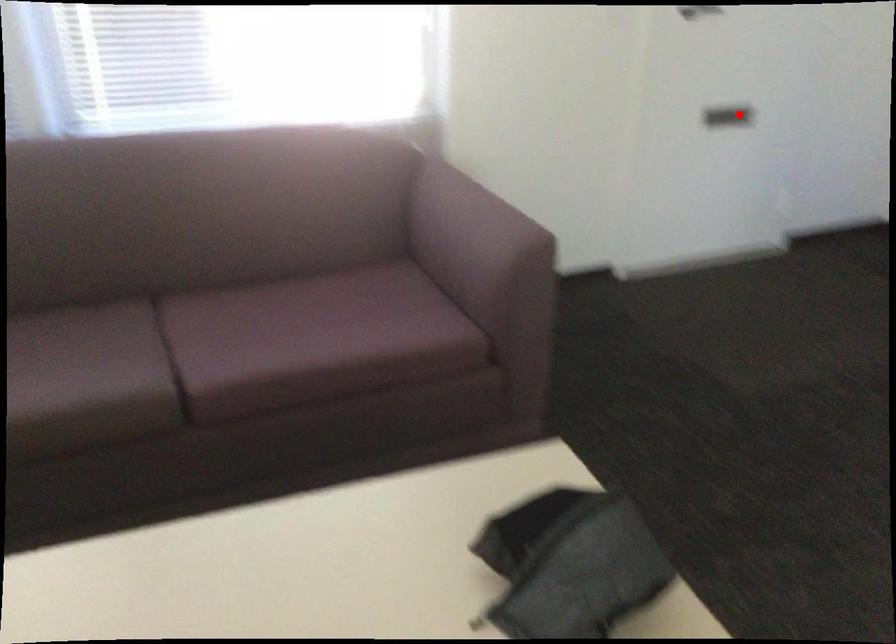
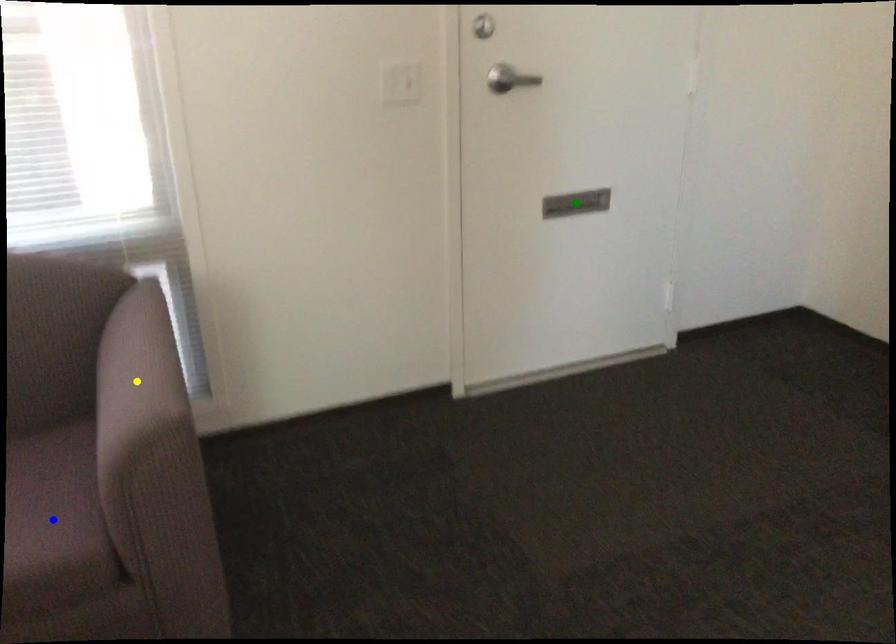
Question: I am providing you with two images of the same scene from different viewpoints. A red point is marked on the first image. You are given multiple points on the second image. Which spot in image 2 lines up with the point in image 1?

Choices:
 (A) blue point
 (B) green point
 (C) yellow point

Answer: (B)